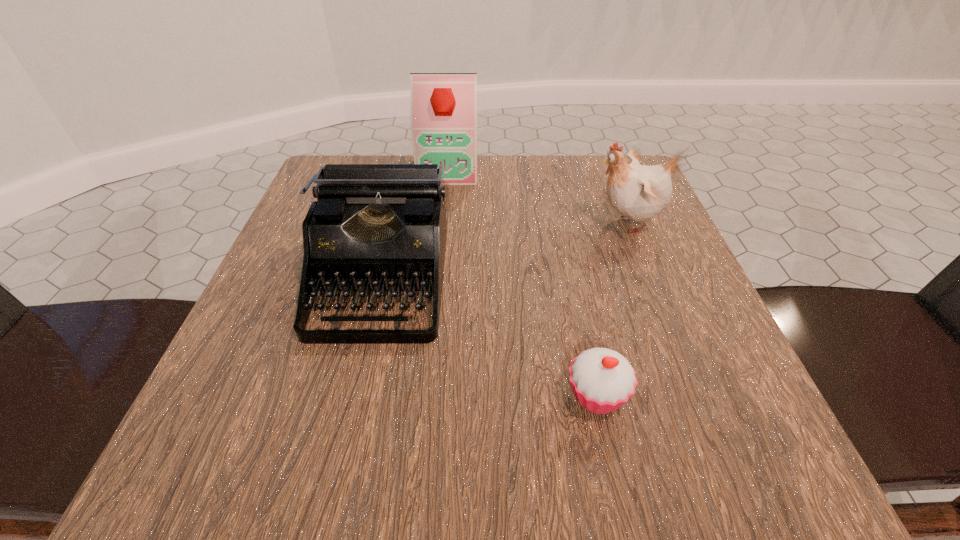
The width and height of the screenshot is (960, 540). I want to click on free space at the near edge of the desktop, so click(x=397, y=472).

You are a GUI agent. You are given a task and a screenshot of the screen. Output one action in this format:
    pyautogui.click(x=<x>, y=<y>)
    Task: Click on the vacant point at the left edge
    
    Given the screenshot: What is the action you would take?
    pyautogui.click(x=278, y=376)

Locate an element on the screen. The image size is (960, 540). vacant space at the right edge of the desktop is located at coordinates (645, 353).

The height and width of the screenshot is (540, 960). Identify the location of vacant space at the far left corner of the desktop. (368, 160).

Image resolution: width=960 pixels, height=540 pixels. Identify the location of free space at the far right corner of the desktop. (581, 166).

In the image, there is a desktop. Identify the location of vacant region at the near right corner. (748, 481).

At what (x,y) coordinates should I click in order to perform the action: click on free space between the nearest object and the bird. Please return your answer as a coordinate pair (x, y). The width and height of the screenshot is (960, 540). Looking at the image, I should click on (612, 309).

Locate an element on the screen. Image resolution: width=960 pixels, height=540 pixels. free point between the tallest object and the rightmost object is located at coordinates (538, 196).

Locate an element on the screen. This screenshot has height=540, width=960. free space between the farthest object and the cupcake is located at coordinates (522, 282).

Find the location of a particular element. free spot between the nearest object and the second tallest object is located at coordinates (612, 309).